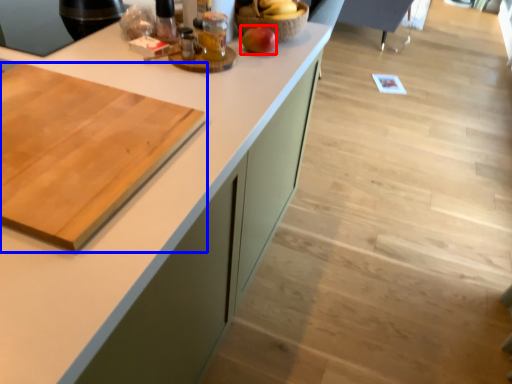
Question: Which object is closer to the camera taking this photo, apple (highlighted by a red box) or cutting board (highlighted by a blue box)?

Choices:
 (A) apple
 (B) cutting board

Answer: (B)